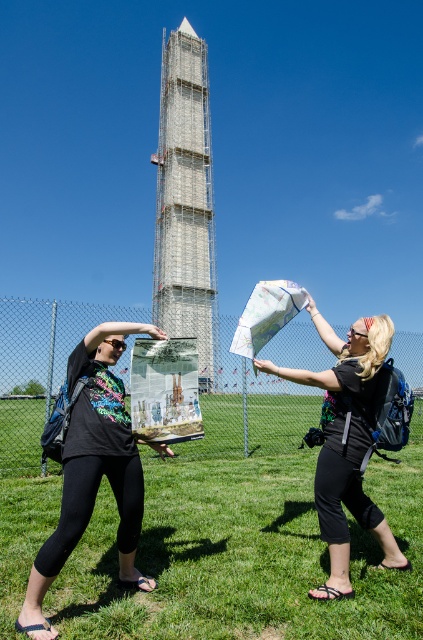
Question: Which point is closer to the camera?

Choices:
 (A) matte black t-shirt at center
 (B) black matte backpack at center
 (C) scaffolding metal tower at center

Answer: (A)

Question: Does black fabric pants at lower center appear on the right side of matte black t-shirt at center?

Choices:
 (A) yes
 (B) no

Answer: (B)

Question: Does black fabric pants at lower center come in front of black matte backpack at center?

Choices:
 (A) yes
 (B) no

Answer: (A)

Question: Which point is closer to the camera?

Choices:
 (A) scaffolding metal tower at center
 (B) black fabric pants at lower center

Answer: (B)

Question: Where is scaffolding metal tower at center located in relation to black matte backpack at center in the image?

Choices:
 (A) left
 (B) right

Answer: (A)

Question: Which is nearer to the black fabric pants at lower center?

Choices:
 (A) matte black t-shirt at center
 (B) scaffolding metal tower at center
 (C) black matte backpack at center

Answer: (C)